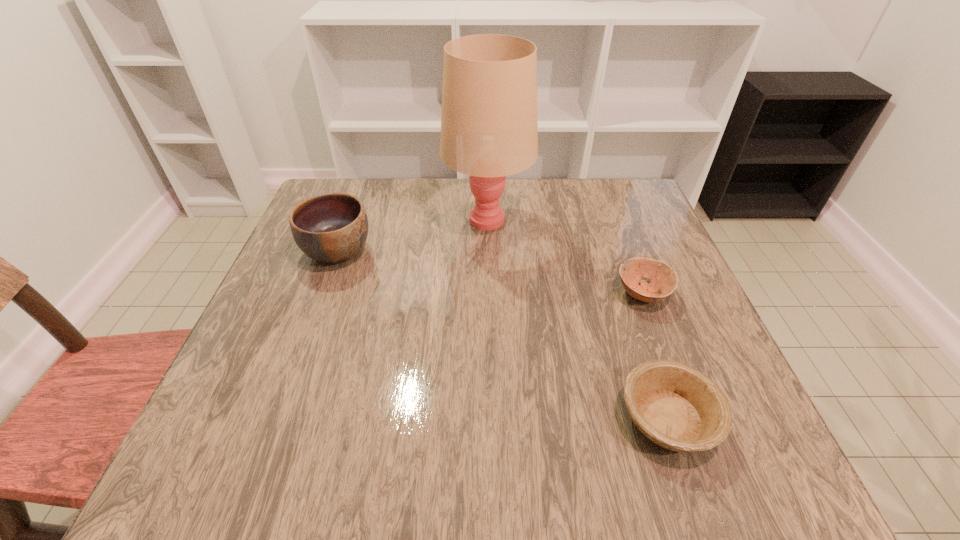
The image size is (960, 540). Find the location of `empty space that is in between the tallest bowl and the lampshade`. empty space that is in between the tallest bowl and the lampshade is located at coordinates (413, 235).

At what (x,y) coordinates should I click in order to perform the action: click on vacant area between the nearest object and the leftmost bowl. Please return your answer as a coordinate pair (x, y). The image size is (960, 540). Looking at the image, I should click on (503, 335).

Where is `free space between the tallest bowl and the lampshade`? The height and width of the screenshot is (540, 960). free space between the tallest bowl and the lampshade is located at coordinates (413, 235).

Identify which object is located as the second nearest to the leftmost bowl. Please provide its 2D coordinates. Your answer should be formatted as a tuple, i.e. [(x, y)], where the tuple contains the x and y coordinates of a point satisfying the conditions above.

[(662, 278)]

Locate which object is the third closest to the leftmost bowl. Please provide its 2D coordinates. Your answer should be formatted as a tuple, i.e. [(x, y)], where the tuple contains the x and y coordinates of a point satisfying the conditions above.

[(676, 406)]

Point out which bowl is positioned as the nearest to the lampshade. Please provide its 2D coordinates. Your answer should be formatted as a tuple, i.e. [(x, y)], where the tuple contains the x and y coordinates of a point satisfying the conditions above.

[(332, 228)]

Point out which bowl is positioned as the second nearest to the nearest object. Please provide its 2D coordinates. Your answer should be formatted as a tuple, i.e. [(x, y)], where the tuple contains the x and y coordinates of a point satisfying the conditions above.

[(332, 228)]

Locate an element on the screen. This screenshot has height=540, width=960. free location that satisfies the following two spatial constraints: 1. on the front side of the leftmost bowl; 2. on the right side of the nearest bowl is located at coordinates (276, 418).

Where is `blank area in the image that satisfies the following two spatial constraints: 1. on the front side of the tallest object; 2. on the left side of the nearest object`? The image size is (960, 540). blank area in the image that satisfies the following two spatial constraints: 1. on the front side of the tallest object; 2. on the left side of the nearest object is located at coordinates (492, 418).